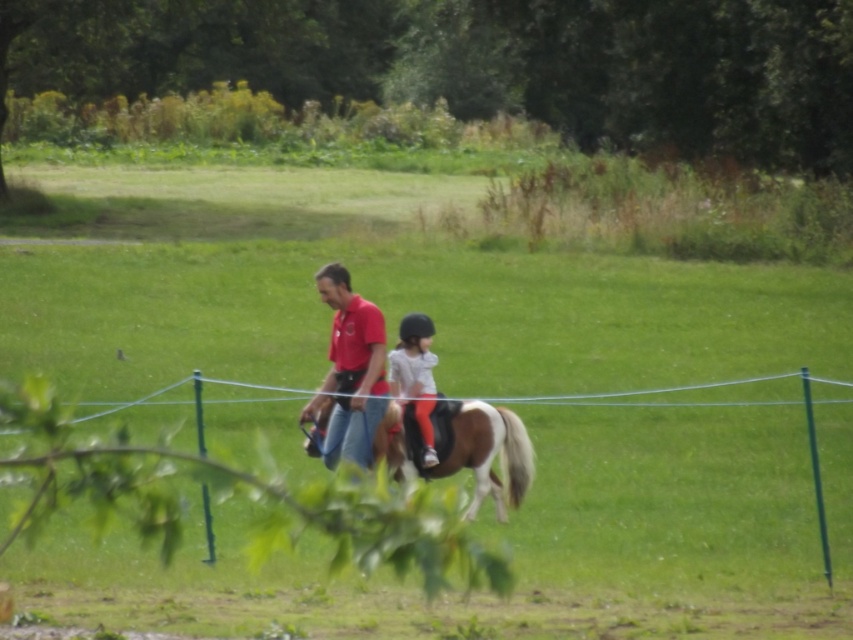
Question: Does matte red shirt at center have a greater width compared to light gray fabric helmet at center?

Choices:
 (A) yes
 (B) no

Answer: (A)

Question: Does blue wire fence at center have a greater width compared to brown glossy horse at center?

Choices:
 (A) yes
 (B) no

Answer: (A)

Question: Which object is farther from the camera taking this photo?

Choices:
 (A) brown glossy horse at center
 (B) blue wire fence at center
 (C) matte red shirt at center
 (D) light gray fabric helmet at center

Answer: (D)

Question: Which object is farther from the camera taking this photo?

Choices:
 (A) light gray fabric helmet at center
 (B) blue wire fence at center
 (C) matte red shirt at center
 (D) brown glossy horse at center

Answer: (A)

Question: Which object is positioned closest to the light gray fabric helmet at center?

Choices:
 (A) matte red shirt at center
 (B) brown glossy horse at center
 (C) blue wire fence at center

Answer: (B)

Question: Does brown glossy horse at center have a smaller size compared to light gray fabric helmet at center?

Choices:
 (A) no
 (B) yes

Answer: (A)